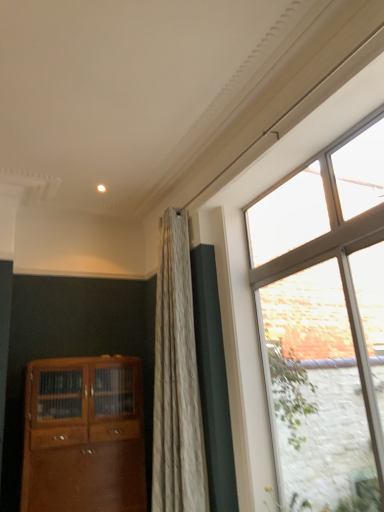
Question: Does matte wood cabinet at lower left come in front of clear glass window at right?

Choices:
 (A) yes
 (B) no

Answer: (B)

Question: Can you confirm if matte wood cabinet at lower left is wider than clear glass window at right?

Choices:
 (A) no
 (B) yes

Answer: (B)

Question: Is matte wood cabinet at lower left not close to clear glass window at right?

Choices:
 (A) yes
 (B) no

Answer: (A)

Question: From a real-world perspective, is matte wood cabinet at lower left positioned over clear glass window at right based on gravity?

Choices:
 (A) yes
 (B) no

Answer: (B)

Question: Is matte wood cabinet at lower left next to clear glass window at right?

Choices:
 (A) yes
 (B) no

Answer: (B)

Question: Considering the relative sizes of matte wood cabinet at lower left and clear glass window at right in the image provided, is matte wood cabinet at lower left smaller than clear glass window at right?

Choices:
 (A) no
 (B) yes

Answer: (A)

Question: From a real-world perspective, is matte wood cabinet at lower left physically above clear glass door at right?

Choices:
 (A) yes
 (B) no

Answer: (B)

Question: Is matte wood cabinet at lower left facing towards clear glass door at right?

Choices:
 (A) yes
 (B) no

Answer: (B)

Question: Does matte wood cabinet at lower left have a lesser width compared to clear glass door at right?

Choices:
 (A) yes
 (B) no

Answer: (B)

Question: Considering the relative positions of matte wood cabinet at lower left and clear glass door at right in the image provided, is matte wood cabinet at lower left to the left of clear glass door at right from the viewer's perspective?

Choices:
 (A) no
 (B) yes

Answer: (B)

Question: Can clear glass door at right be found inside matte wood cabinet at lower left?

Choices:
 (A) yes
 (B) no

Answer: (B)

Question: Can you confirm if matte wood cabinet at lower left is taller than clear glass door at right?

Choices:
 (A) yes
 (B) no

Answer: (B)

Question: Does clear glass window at right have a larger size compared to matte wood cabinet at lower left?

Choices:
 (A) no
 (B) yes

Answer: (A)